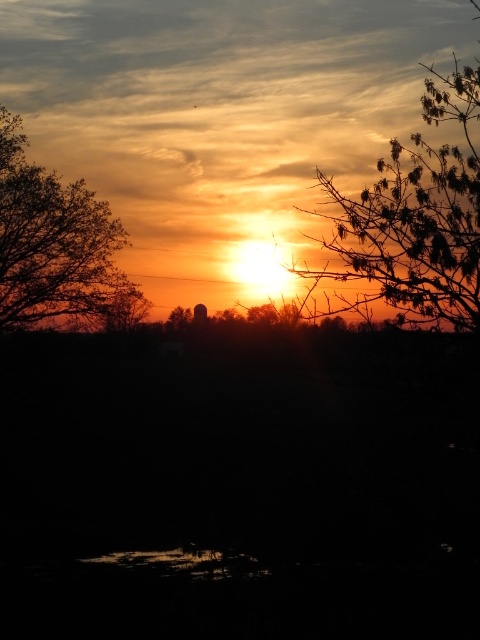
Find the location of `silhouetted leafy branch at upper right`. silhouetted leafy branch at upper right is located at coordinates (417, 216).

Describe the element at coordinates (417, 216) in the screenshot. I see `silhouetted leafy branch at upper right` at that location.

Does point (408, 161) lie in front of point (43, 298)?

Yes, point (408, 161) is in front of point (43, 298).

Image resolution: width=480 pixels, height=640 pixels. I want to click on silhouetted leafy branch at upper right, so click(417, 216).